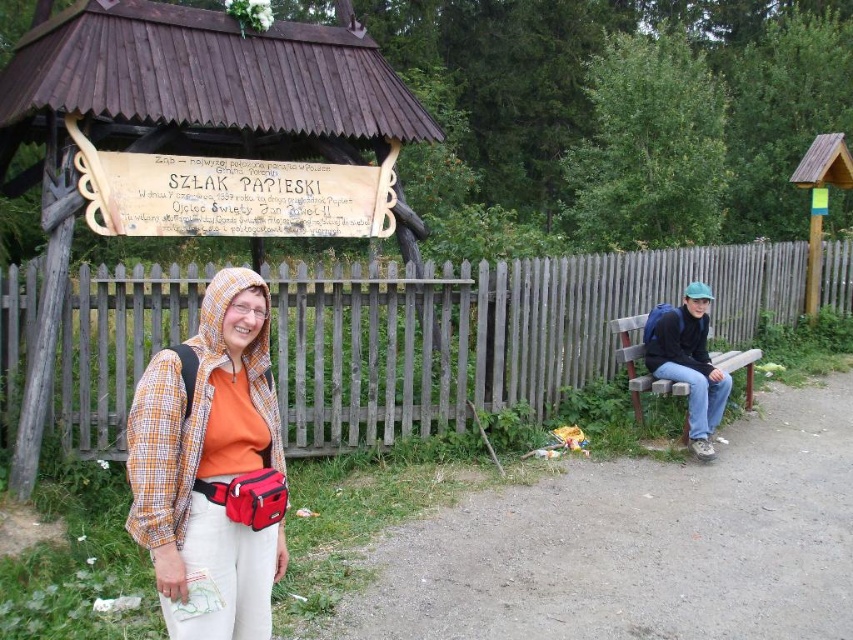
You are a delivery robot with a width of 1.2 meters. You need to navigate between the wooden at center and the dirt path at center. Can you pass through the space between them?

The wooden at center and dirt path at center are 2.56 meters apart from each other. Since the robot is 1.2 meters wide, there is enough space to pass through the gap between them.

You are a photographer setting up a tripod to capture the scene. The matte orange shirt at center and the wooden bench at right are both in your frame. Which object is positioned higher in the image?

The matte orange shirt at center is taller than the wooden bench at right, so it is positioned higher in the image.

From the picture: You are taking a photo of the matte orange shirt at center and the wooden bench at right. Which object will appear larger in the photo?

The matte orange shirt at center will appear larger in the photo because it is closer to the viewer than the wooden bench at right.